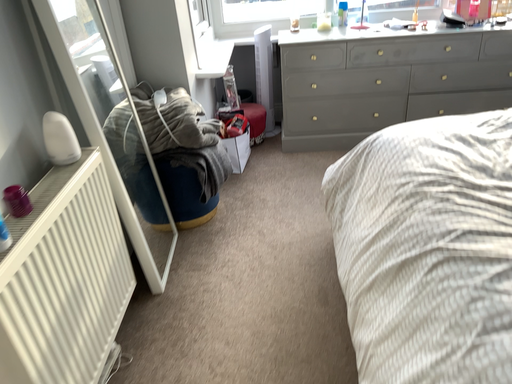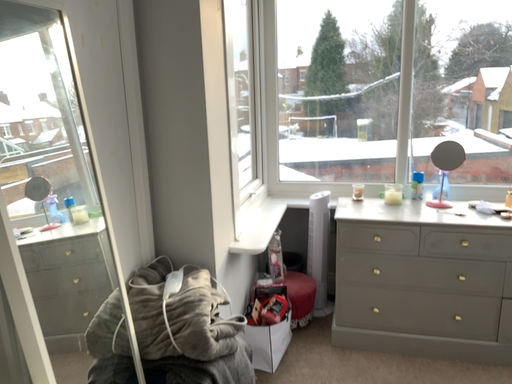
Question: How did the camera likely rotate when shooting the video?

Choices:
 (A) rotated downward
 (B) rotated upward

Answer: (B)